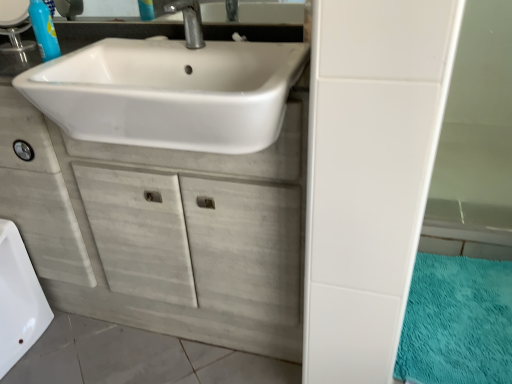
Where is `empty space that is ontop of teal plush bath mat at lower right (from a real-world perspective)`? empty space that is ontop of teal plush bath mat at lower right (from a real-world perspective) is located at coordinates (461, 306).